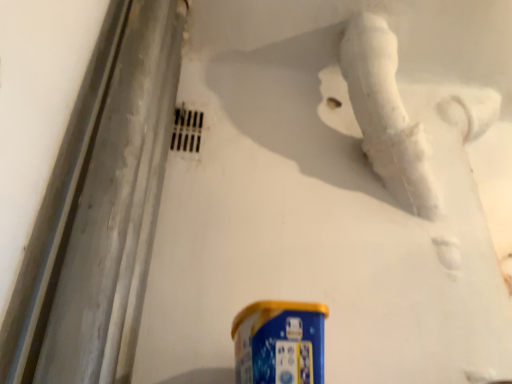
Question: Relative to blue metallic spray can at bottom, is white marble water pipe at upper right in front or behind?

Choices:
 (A) behind
 (B) front

Answer: (A)

Question: From a real-world perspective, is white marble water pipe at upper right positioned above or below blue metallic spray can at bottom?

Choices:
 (A) above
 (B) below

Answer: (A)

Question: Is white marble water pipe at upper right wider or thinner than blue metallic spray can at bottom?

Choices:
 (A) wide
 (B) thin

Answer: (B)

Question: From a real-world perspective, relative to white marble water pipe at upper right, is blue metallic spray can at bottom vertically above or below?

Choices:
 (A) below
 (B) above

Answer: (A)

Question: Is blue metallic spray can at bottom to the left or to the right of white marble water pipe at upper right in the image?

Choices:
 (A) left
 (B) right

Answer: (A)

Question: Considering the positions of blue metallic spray can at bottom and white marble water pipe at upper right in the image, is blue metallic spray can at bottom taller or shorter than white marble water pipe at upper right?

Choices:
 (A) short
 (B) tall

Answer: (A)

Question: Considering the positions of point (263, 360) and point (359, 56), is point (263, 360) closer or farther from the camera than point (359, 56)?

Choices:
 (A) closer
 (B) farther

Answer: (A)